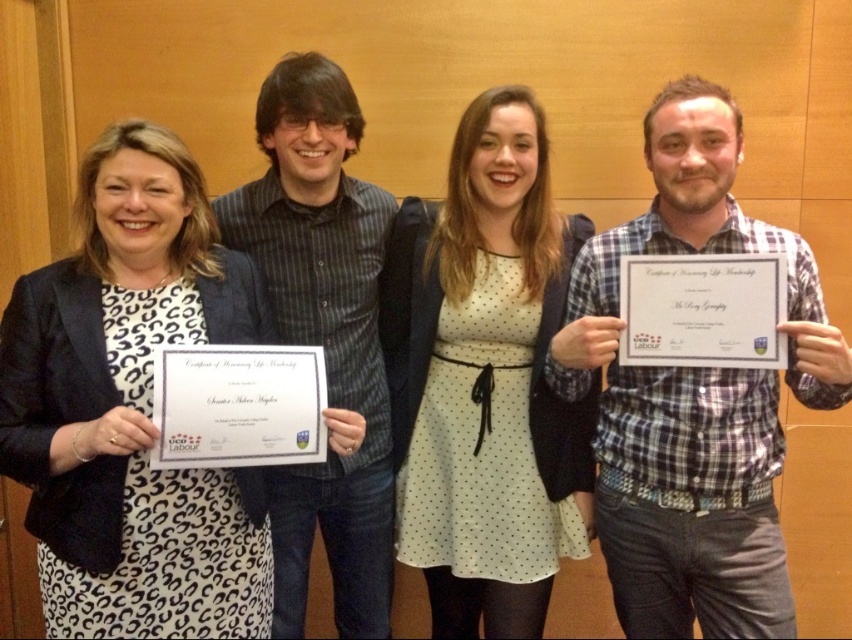
You are standing in front of the group photo and want to determine which of the two points, point (544, 184) or point (272, 492), is nearer to you. Based on the scene description, which point is closer?

Point (544, 184) is closer to the viewer than point (272, 492).

You are a photographer standing at the camera position. You want to adjust the focus to ensure the white dotted dress at center is in sharp focus. What distance should you set the focus to?

The white dotted dress at center is 5.65 feet away from the camera, so you should set the focus distance to 5.65 feet to ensure it is in sharp focus.

You are a photographer trying to focus on the white dotted dress at center and the white paper certificate at right. Which object should you adjust your camera focus on first to ensure both are in focus?

The white dotted dress at center is closer to the photographer than the white paper certificate at right. To ensure both are in focus, adjust the camera focus on the white dotted dress at center first, as it is closer, and then adjust for the white paper certificate at right which is further away.